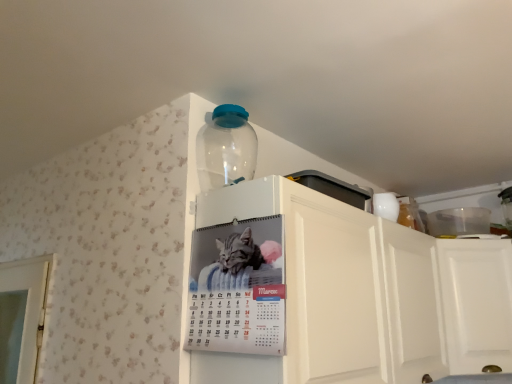
Question: Is there a large distance between transparent plastic bottle at upper center and white matte cabinet at upper center?

Choices:
 (A) yes
 (B) no

Answer: (B)

Question: Is transparent plastic bottle at upper center closer to the viewer compared to white matte cabinet at upper center?

Choices:
 (A) no
 (B) yes

Answer: (A)

Question: From the image's perspective, is transparent plastic bottle at upper center below white matte cabinet at upper center?

Choices:
 (A) yes
 (B) no

Answer: (B)

Question: Is transparent plastic bottle at upper center outside of white matte cabinet at upper center?

Choices:
 (A) yes
 (B) no

Answer: (A)

Question: Is transparent plastic bottle at upper center oriented away from white matte cabinet at upper center?

Choices:
 (A) yes
 (B) no

Answer: (B)

Question: Could you tell me if transparent plastic bottle at upper center is facing white matte cabinet at upper center?

Choices:
 (A) no
 (B) yes

Answer: (A)

Question: Could you tell me if white matte cabinet at upper center is turned towards metallic silver calendar at upper center?

Choices:
 (A) no
 (B) yes

Answer: (A)

Question: From the image's perspective, is white matte cabinet at upper center located above metallic silver calendar at upper center?

Choices:
 (A) yes
 (B) no

Answer: (B)

Question: Considering the relative sizes of white matte cabinet at upper center and metallic silver calendar at upper center in the image provided, is white matte cabinet at upper center wider than metallic silver calendar at upper center?

Choices:
 (A) no
 (B) yes

Answer: (B)

Question: Considering the relative sizes of white matte cabinet at upper center and metallic silver calendar at upper center in the image provided, is white matte cabinet at upper center shorter than metallic silver calendar at upper center?

Choices:
 (A) no
 (B) yes

Answer: (A)

Question: From a real-world perspective, is white matte cabinet at upper center under metallic silver calendar at upper center?

Choices:
 (A) no
 (B) yes

Answer: (B)

Question: Is white matte cabinet at upper center closer to camera compared to metallic silver calendar at upper center?

Choices:
 (A) yes
 (B) no

Answer: (A)

Question: From a real-world perspective, is transparent plastic bottle at upper center on top of metallic silver calendar at upper center?

Choices:
 (A) no
 (B) yes

Answer: (B)